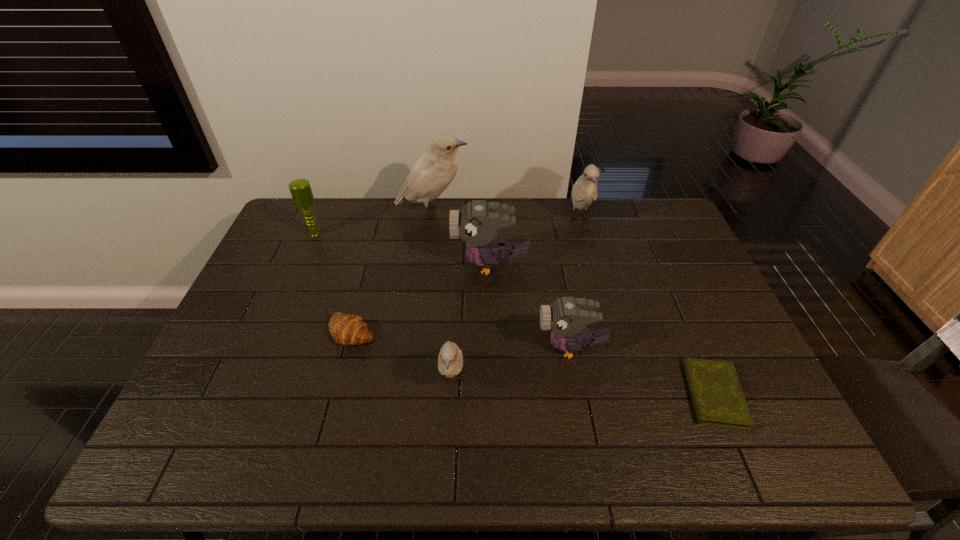
The width and height of the screenshot is (960, 540). What are the coordinates of `vacant region between the microphone and the brown crescent roll` in the screenshot? It's located at (334, 283).

In order to click on free space between the microphone and the second shortest object in this screenshot , I will do `click(334, 283)`.

Where is `free space between the bigger gray bird and the rightmost white bird`? Image resolution: width=960 pixels, height=540 pixels. free space between the bigger gray bird and the rightmost white bird is located at coordinates (535, 242).

Identify which object is located as the sixth nearest to the nearer gray bird. Please provide its 2D coordinates. Your answer should be formatted as a tuple, i.e. [(x, y)], where the tuple contains the x and y coordinates of a point satisfying the conditions above.

[(433, 172)]

Choose which object is the sixth nearest neighbor to the diary. Please provide its 2D coordinates. Your answer should be formatted as a tuple, i.e. [(x, y)], where the tuple contains the x and y coordinates of a point satisfying the conditions above.

[(433, 172)]

Locate which bird ranks third in proximity to the rightmost object. Please provide its 2D coordinates. Your answer should be formatted as a tuple, i.e. [(x, y)], where the tuple contains the x and y coordinates of a point satisfying the conditions above.

[(584, 191)]

Locate which bird ranks fourth in proximity to the crescent roll. Please provide its 2D coordinates. Your answer should be formatted as a tuple, i.e. [(x, y)], where the tuple contains the x and y coordinates of a point satisfying the conditions above.

[(433, 172)]

Choose which white bird is the second nearest neighbor to the nearest white bird. Please provide its 2D coordinates. Your answer should be formatted as a tuple, i.e. [(x, y)], where the tuple contains the x and y coordinates of a point satisfying the conditions above.

[(584, 191)]

Find the location of a particular element. The height and width of the screenshot is (540, 960). white bird that stands as the closest to the smallest white bird is located at coordinates (433, 172).

Locate an element on the screen. This screenshot has height=540, width=960. free spot that satisfies the following two spatial constraints: 1. at the beak of the smaller gray bird; 2. on the right side of the rightmost object is located at coordinates (580, 394).